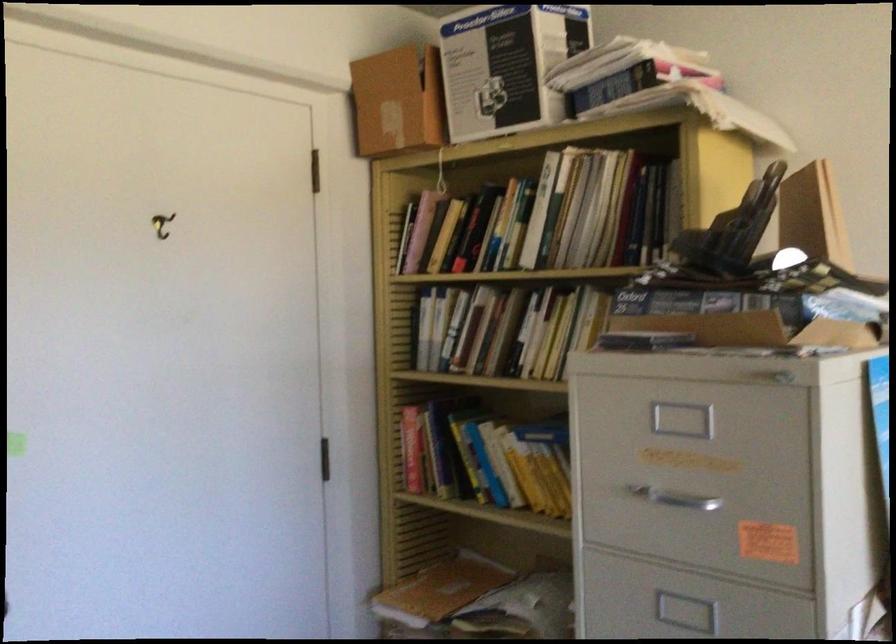
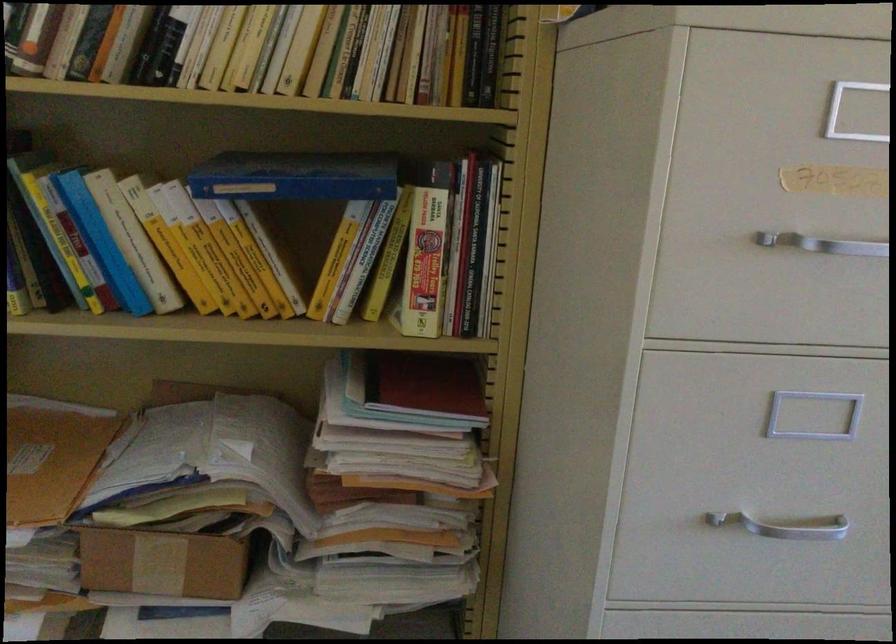
Find the pixel in the second image that matches the point at 661,496 in the first image.

(823, 243)